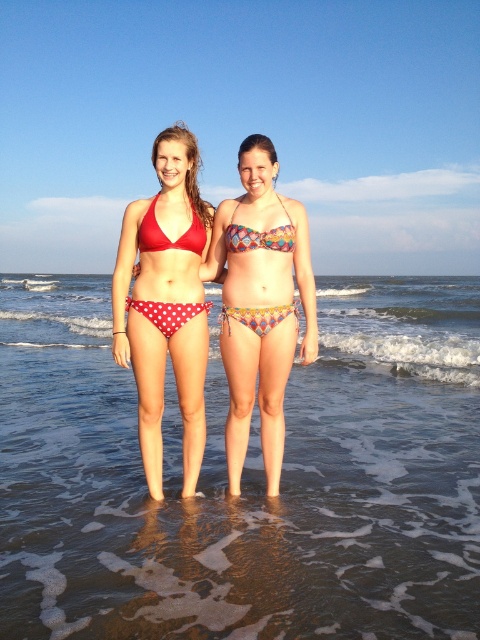
You are a swimmer standing at the edge of the beach. You see the clear water at lower center and the polka dot matte bikini at center. Which one is wider?

The clear water at lower center might be wider than the polka dot matte bikini at center.

You are standing at the edge of the beach and want to walk towards the clear water at lower center. Based on the coordinates provided in the description, which direction should you move relative to your current position?

The clear water at lower center is located at coordinates point [244,476], so you should move towards the lower center direction to reach it.